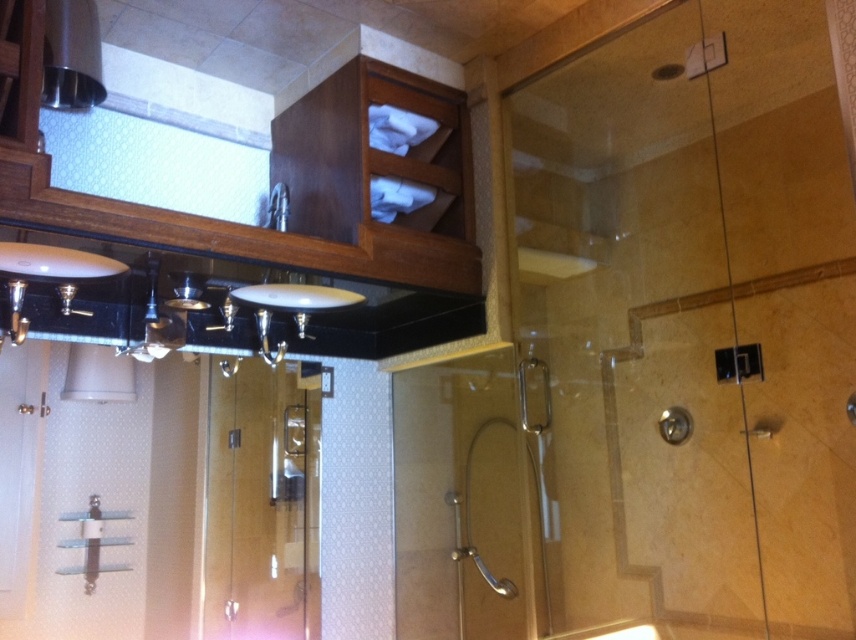
Can you confirm if clear glass shower door at center is positioned above satin nickel faucet at upper center?

Incorrect, clear glass shower door at center is not positioned above satin nickel faucet at upper center.

Is point (468, 509) closer to camera compared to point (287, 189)?

No, (468, 509) is behind (287, 189).

This screenshot has height=640, width=856. In order to click on clear glass shower door at center in this screenshot , I will do `click(456, 500)`.

Does white glossy sink at center have a smaller size compared to satin nickel faucet at upper center?

No, white glossy sink at center is not smaller than satin nickel faucet at upper center.

Is white glossy sink at center positioned in front of satin nickel faucet at upper center?

Yes.

Locate an element on the screen. This screenshot has width=856, height=640. white glossy sink at center is located at coordinates (295, 298).

The image size is (856, 640). What do you see at coordinates (456, 500) in the screenshot? I see `clear glass shower door at center` at bounding box center [456, 500].

Is clear glass shower door at center further to the viewer compared to white glossy sink at center?

Yes, clear glass shower door at center is further from the viewer.

Between point (412, 381) and point (337, 289), which one is positioned behind?

Point (412, 381)

The width and height of the screenshot is (856, 640). Identify the location of clear glass shower door at center. (456, 500).